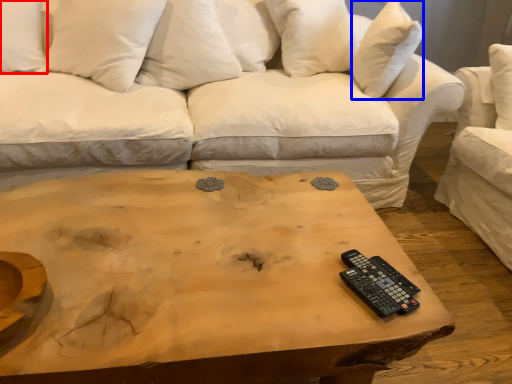
Question: Which object appears farthest to the camera in this image, pillow (highlighted by a red box) or pillow (highlighted by a blue box)?

Choices:
 (A) pillow
 (B) pillow

Answer: (B)